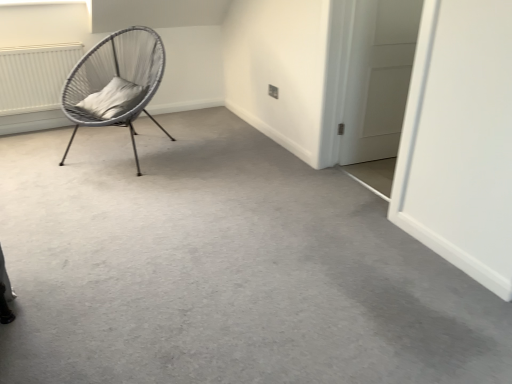
Question: From the image's perspective, relative to woven grey chair at left, is gray carpet at center above or below?

Choices:
 (A) above
 (B) below

Answer: (B)

Question: Relative to woven grey chair at left, is gray carpet at center in front or behind?

Choices:
 (A) behind
 (B) front

Answer: (B)

Question: Which object is positioned closest to the white soft cushion at left?

Choices:
 (A) gray carpet at center
 (B) white matte door at right
 (C) woven grey chair at left
 (D) white textured radiator at upper left

Answer: (C)

Question: Estimate the real-world distances between objects in this image. Which object is farther from the white soft cushion at left?

Choices:
 (A) woven grey chair at left
 (B) gray carpet at center
 (C) white matte door at right
 (D) white textured radiator at upper left

Answer: (C)